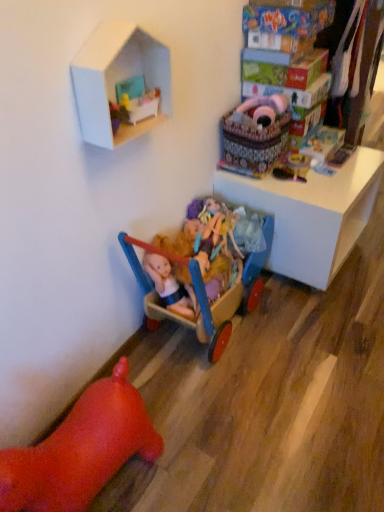
Locate an element on the screen. free space in front of wooden toy car at upper right, which ranks as the seventh toy in left-to-right order is located at coordinates (350, 175).